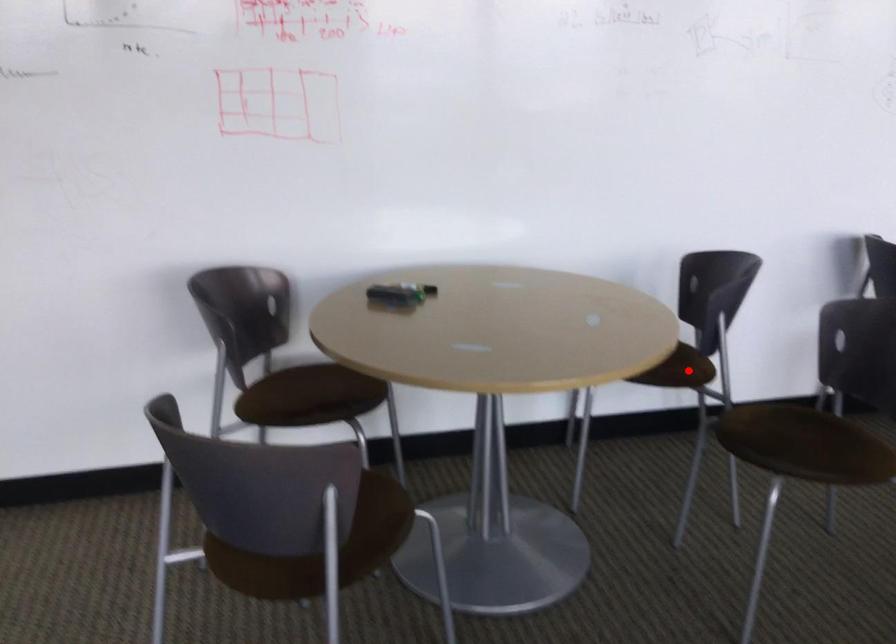
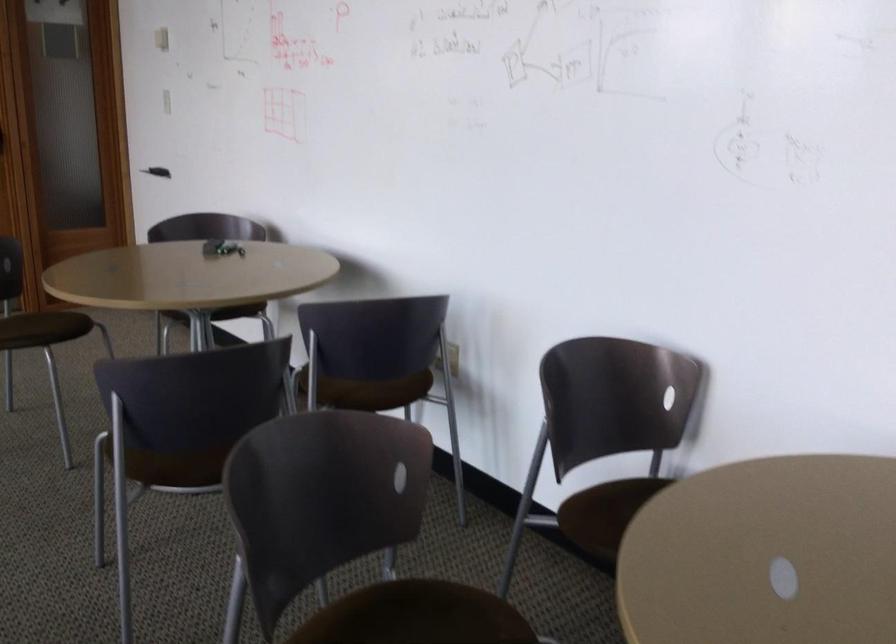
Locate, in the second image, the point that corresponds to the highlighted location in the first image.

(347, 392)